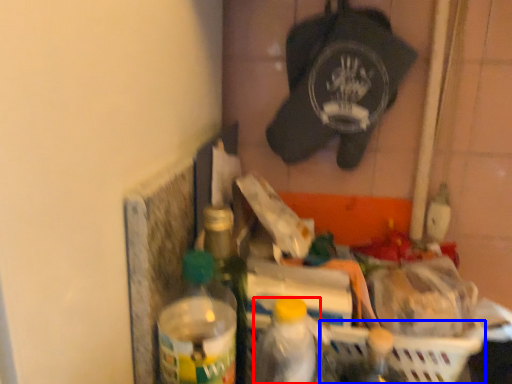
Question: Which point is closer to the camera, bottle (highlighted by a red box) or basket (highlighted by a blue box)?

Choices:
 (A) bottle
 (B) basket

Answer: (A)